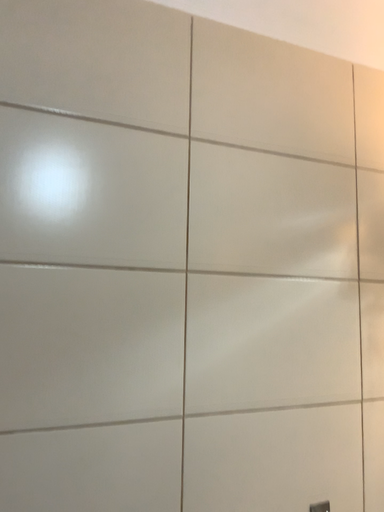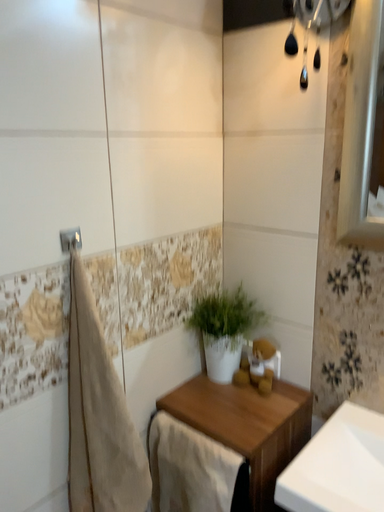
Question: How did the camera likely rotate when shooting the video?

Choices:
 (A) rotated left
 (B) rotated right

Answer: (B)